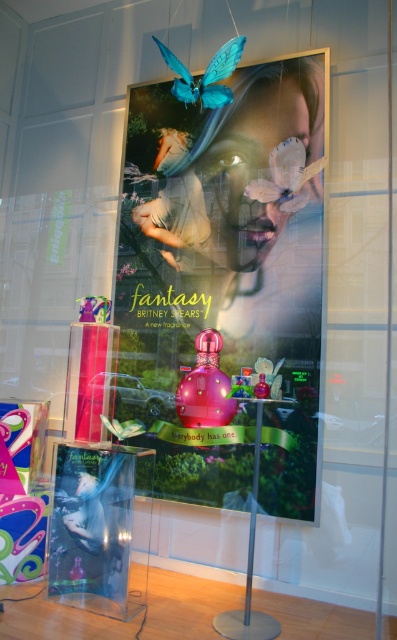
Which is below, pink glossy perfume at center or teal matte butterfly at upper center?

Positioned lower is pink glossy perfume at center.

Where is `pink glossy perfume at center`? pink glossy perfume at center is located at coordinates (204, 387).

Locate an element on the screen. This screenshot has height=640, width=397. pink glossy perfume at center is located at coordinates (204, 387).

Consider the image. Can you confirm if glossy plastic poster at center is shorter than teal matte butterfly at upper center?

No.

Is glossy plastic poster at center below teal matte butterfly at upper center?

Indeed, glossy plastic poster at center is positioned under teal matte butterfly at upper center.

The image size is (397, 640). I want to click on glossy plastic poster at center, so click(225, 282).

Is translucent plastic bottle at lower left below pink glossy perfume at center?

Yes.

Is translucent plastic bottle at lower left to the left of pink glossy perfume at center from the viewer's perspective?

Correct, you'll find translucent plastic bottle at lower left to the left of pink glossy perfume at center.

The width and height of the screenshot is (397, 640). What do you see at coordinates (90, 528) in the screenshot?
I see `translucent plastic bottle at lower left` at bounding box center [90, 528].

You are a GUI agent. You are given a task and a screenshot of the screen. Output one action in this format:
    pyautogui.click(x=<x>, y=<y>)
    Task: Click on the translucent plastic bottle at lower left
    
    Given the screenshot: What is the action you would take?
    (90, 528)